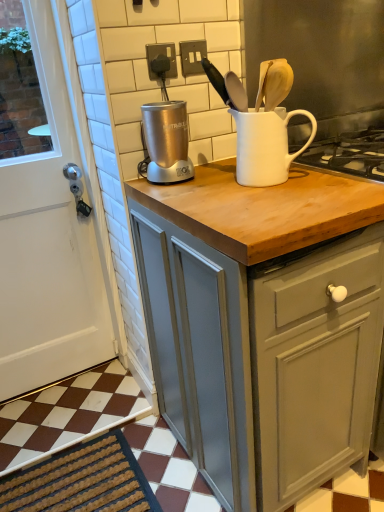
Question: Does satin silver blender at upper center appear on the left side of dark brown textured mat at lower left?

Choices:
 (A) no
 (B) yes

Answer: (A)

Question: Considering the relative sizes of satin silver blender at upper center and dark brown textured mat at lower left in the image provided, is satin silver blender at upper center wider than dark brown textured mat at lower left?

Choices:
 (A) yes
 (B) no

Answer: (B)

Question: Is satin silver blender at upper center positioned behind dark brown textured mat at lower left?

Choices:
 (A) yes
 (B) no

Answer: (B)

Question: Is satin silver blender at upper center to the right of dark brown textured mat at lower left from the viewer's perspective?

Choices:
 (A) yes
 (B) no

Answer: (A)

Question: Are satin silver blender at upper center and dark brown textured mat at lower left making contact?

Choices:
 (A) no
 (B) yes

Answer: (A)

Question: In terms of size, does dark brown textured mat at lower left appear bigger or smaller than matte gray cabinet at center?

Choices:
 (A) big
 (B) small

Answer: (B)

Question: Is dark brown textured mat at lower left situated inside matte gray cabinet at center or outside?

Choices:
 (A) inside
 (B) outside

Answer: (B)

Question: From the image's perspective, relative to matte gray cabinet at center, is dark brown textured mat at lower left above or below?

Choices:
 (A) above
 (B) below

Answer: (B)

Question: Looking at their shapes, would you say dark brown textured mat at lower left is wider or thinner than matte gray cabinet at center?

Choices:
 (A) thin
 (B) wide

Answer: (A)

Question: Is white ceramic jug at upper center wider or thinner than satin silver blender at upper center?

Choices:
 (A) thin
 (B) wide

Answer: (B)

Question: Relative to satin silver blender at upper center, is white ceramic jug at upper center in front or behind?

Choices:
 (A) behind
 (B) front

Answer: (B)

Question: From the image's perspective, is white ceramic jug at upper center located above or below satin silver blender at upper center?

Choices:
 (A) below
 (B) above

Answer: (A)

Question: Is point (302, 145) positioned closer to the camera than point (167, 117)?

Choices:
 (A) farther
 (B) closer

Answer: (B)

Question: Is white matte door at left taller or shorter than white ceramic jug at upper center?

Choices:
 (A) tall
 (B) short

Answer: (A)

Question: Considering the positions of white matte door at left and white ceramic jug at upper center in the image, is white matte door at left wider or thinner than white ceramic jug at upper center?

Choices:
 (A) thin
 (B) wide

Answer: (A)